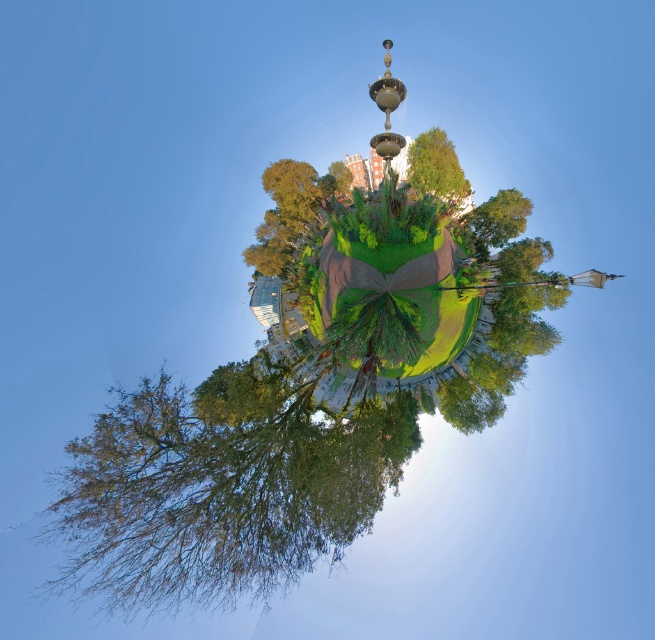
Can you confirm if green leafy tree at lower left is positioned to the left of green leafy tree at center?

Yes, green leafy tree at lower left is to the left of green leafy tree at center.

What do you see at coordinates (223, 484) in the screenshot?
I see `green leafy tree at lower left` at bounding box center [223, 484].

Identify the location of green leafy tree at lower left. (223, 484).

What do you see at coordinates (223, 484) in the screenshot?
I see `green leafy tree at lower left` at bounding box center [223, 484].

Can you confirm if green leafy tree at lower left is positioned to the left of polished brass fountain at center?

Indeed, green leafy tree at lower left is positioned on the left side of polished brass fountain at center.

Which is behind, point (178, 390) or point (402, 96)?

Point (402, 96)

At what (x,y) coordinates should I click in order to perform the action: click on green leafy tree at lower left. Please return your answer as a coordinate pair (x, y). Looking at the image, I should click on (223, 484).

Is green leafy tree at lower left to the right of green leafy tree at upper center from the viewer's perspective?

Incorrect, green leafy tree at lower left is not on the right side of green leafy tree at upper center.

Which is more to the right, green leafy tree at lower left or green leafy tree at upper center?

From the viewer's perspective, green leafy tree at upper center appears more on the right side.

Describe the element at coordinates (223, 484) in the screenshot. I see `green leafy tree at lower left` at that location.

Find the location of a particular element. green leafy tree at lower left is located at coordinates (223, 484).